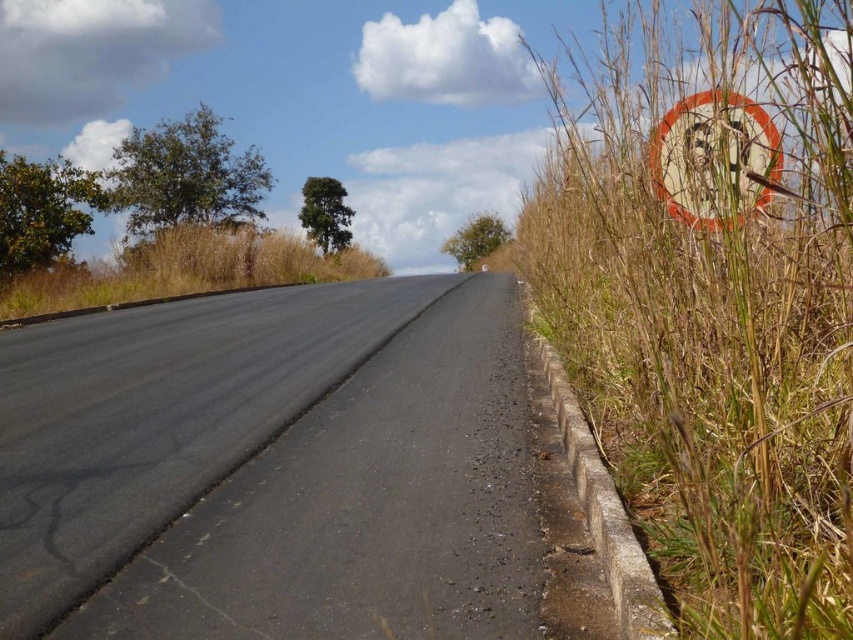
You are driving a car and want to check the speed limit sign. However, the dry grass at left is blocking your view. Is the white plastic speed limit sign at right still visible to you?

The white plastic speed limit sign at right is behind dry grass at left, so it might be partially or fully obstructed, making it less visible or not visible at all.

You are standing at the center of the road and want to reach the brown dry grass at right. Which direction should you move to get there?

You should move to the right to reach the brown dry grass at right since it is located at the right side of the road.

You are a driver approaching the road and need to park your car. The parking spot is between the brown dry grass at right and the dry grass at left. Which side of the parking spot has wider vegetation?

The brown dry grass at right is wider than the dry grass at left, so the right side has wider vegetation.